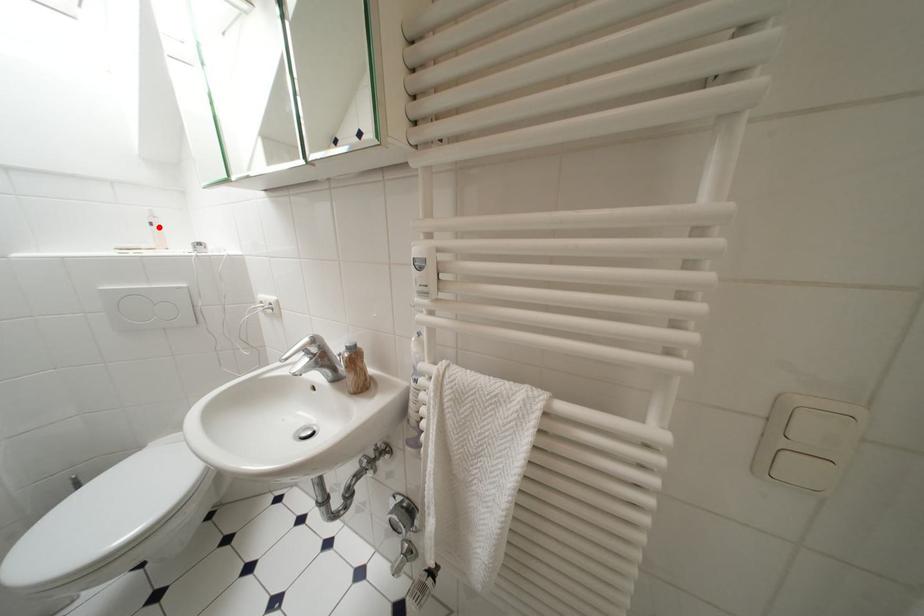
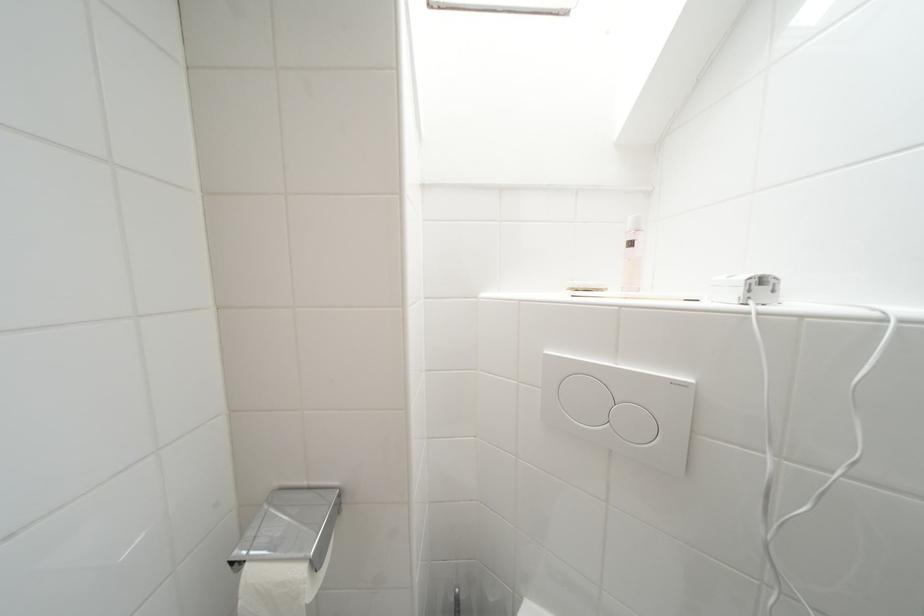
Question: I am providing you with two images of the same scene from different viewpoints. A red point is marked on the first image. Can you still see the location of the red point in image 2?

Choices:
 (A) Yes
 (B) No

Answer: (A)